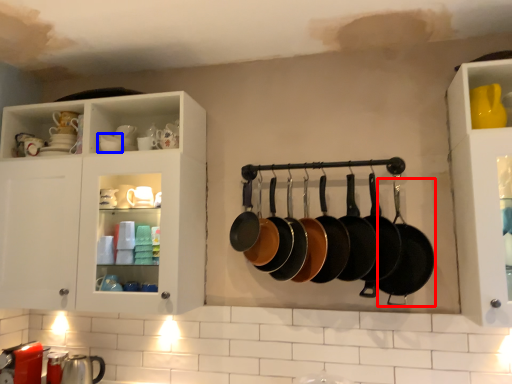
Question: Which of the following is the closest to the observer, frying pan (highlighted by a red box) or tableware (highlighted by a blue box)?

Choices:
 (A) frying pan
 (B) tableware

Answer: (A)